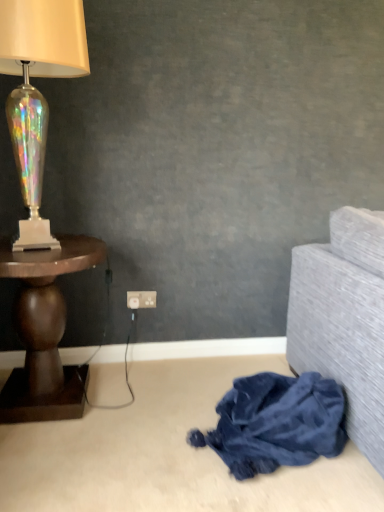
Question: Is velvety blue blanket at lower right positioned before white plastic power outlet at center?

Choices:
 (A) no
 (B) yes

Answer: (B)

Question: From the image's perspective, is velvety blue blanket at lower right under white plastic power outlet at center?

Choices:
 (A) no
 (B) yes

Answer: (B)

Question: From a real-world perspective, does velvety blue blanket at lower right sit lower than white plastic power outlet at center?

Choices:
 (A) yes
 (B) no

Answer: (A)

Question: Is velvety blue blanket at lower right aimed at white plastic power outlet at center?

Choices:
 (A) yes
 (B) no

Answer: (B)

Question: Is white plastic power outlet at center surrounded by velvety blue blanket at lower right?

Choices:
 (A) yes
 (B) no

Answer: (B)

Question: In terms of height, does dark wood table at left look taller or shorter compared to velvety blue blanket at lower right?

Choices:
 (A) short
 (B) tall

Answer: (B)

Question: In terms of width, does dark wood table at left look wider or thinner when compared to velvety blue blanket at lower right?

Choices:
 (A) wide
 (B) thin

Answer: (A)

Question: Is dark wood table at left in front of or behind velvety blue blanket at lower right in the image?

Choices:
 (A) front
 (B) behind

Answer: (B)

Question: Considering the positions of dark wood table at left and velvety blue blanket at lower right in the image, is dark wood table at left bigger or smaller than velvety blue blanket at lower right?

Choices:
 (A) small
 (B) big

Answer: (B)

Question: Is velvety blue blanket at lower right to the left or to the right of dark wood table at left in the image?

Choices:
 (A) left
 (B) right

Answer: (B)

Question: Is velvety blue blanket at lower right spatially inside dark wood table at left, or outside of it?

Choices:
 (A) inside
 (B) outside

Answer: (B)

Question: In terms of height, does velvety blue blanket at lower right look taller or shorter compared to dark wood table at left?

Choices:
 (A) tall
 (B) short

Answer: (B)

Question: Relative to dark wood table at left, is velvety blue blanket at lower right in front or behind?

Choices:
 (A) behind
 (B) front

Answer: (B)

Question: In terms of width, does velvety blue blanket at lower right look wider or thinner when compared to iridescent glass lamp at left?

Choices:
 (A) thin
 (B) wide

Answer: (B)

Question: In terms of height, does velvety blue blanket at lower right look taller or shorter compared to iridescent glass lamp at left?

Choices:
 (A) tall
 (B) short

Answer: (B)